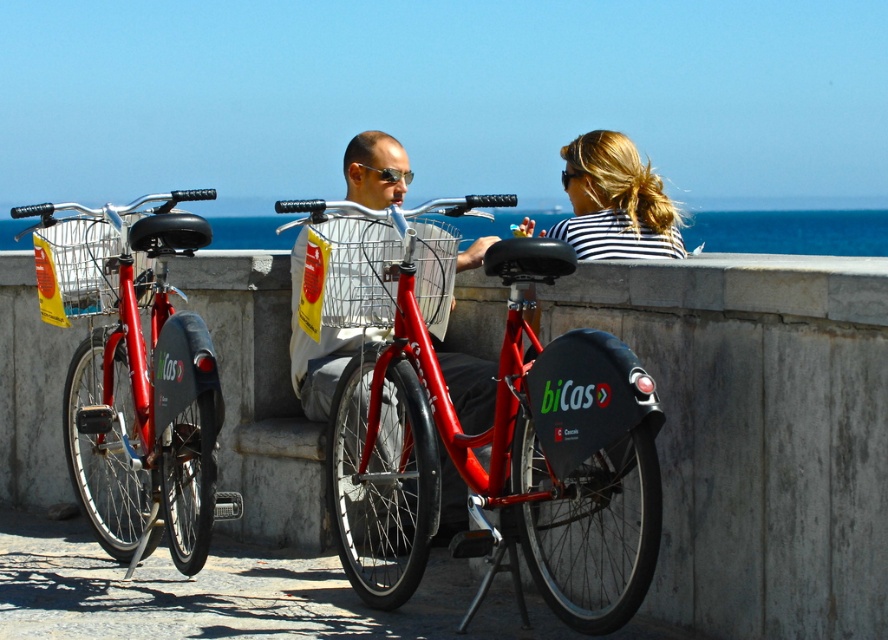
You are a delivery person trying to load a package onto the shiny red bicycle at center and the striped fabric hair at center. Which object can you place a larger package on?

The shiny red bicycle at center has a larger size compared to striped fabric hair at center, so you can place a larger package on the shiny red bicycle at center.

You are a delivery person needing to load a small package onto one of the bicycles. The package requires placement on the highest possible point. Which bicycle should you choose between the shiny red bicycle at center and the matte red bicycle at left?

The matte red bicycle at left is higher than the shiny red bicycle at center, so you should choose the matte red bicycle at left to place the package.

You are a photographer trying to capture both the shiny red bicycle at center and the striped fabric hair at center in a single frame. Since the bicycle is wider than the hair, which object should you position closer to the center of your camera frame to ensure both fit without cropping?

You should position the shiny red bicycle at center closer to the center of your camera frame because it is wider than the striped fabric hair at center, allowing both to fit within the frame without cropping.